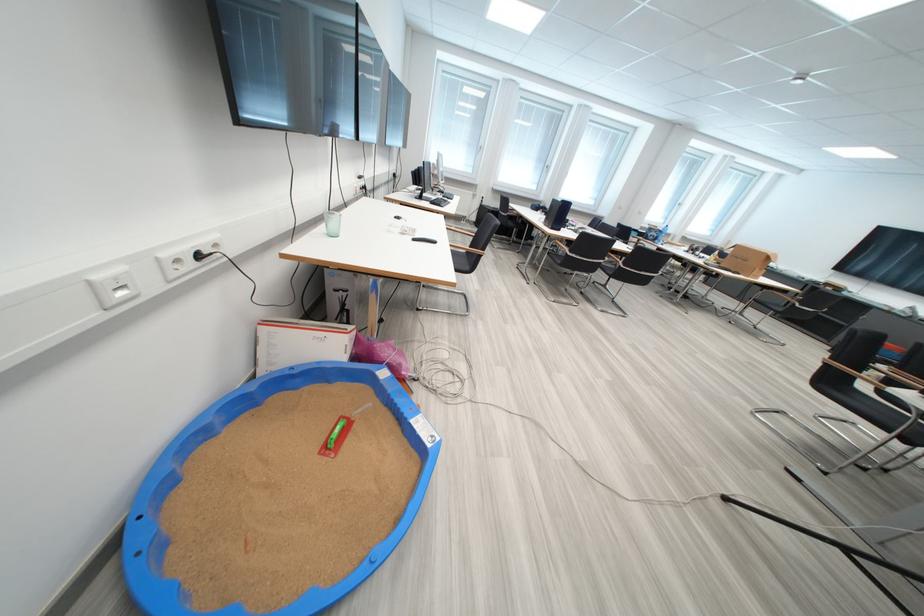
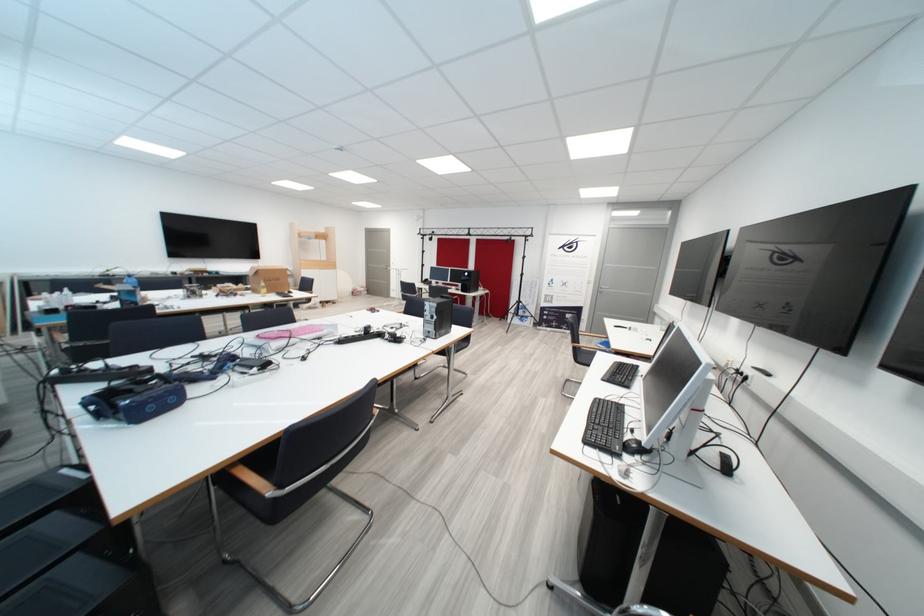
Question: I am providing you with two images of the same scene from different viewpoints. Please identify which objects are invisible in image2.

Choices:
 (A) cardboard box
 (B) gray door handle
 (C) black computer mouse
 (D) rolled white paper

Answer: (A)